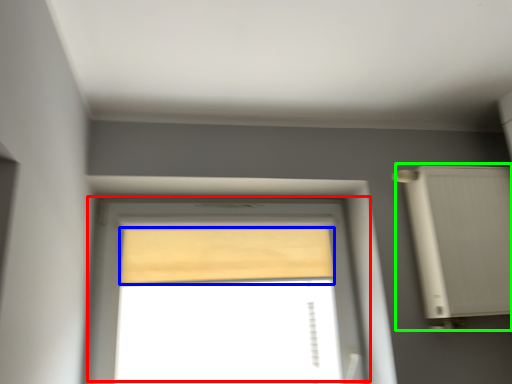
Question: Which object is the farthest from window (highlighted by a red box)? Choose among these: curtain (highlighted by a blue box) or air conditioner (highlighted by a green box).

Choices:
 (A) curtain
 (B) air conditioner

Answer: (B)